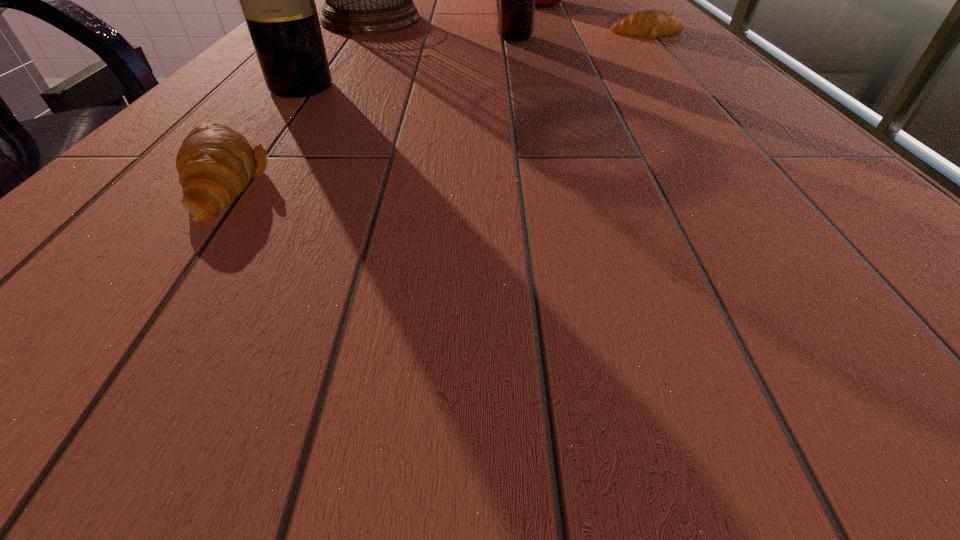
Find the location of `the left crescent roll`. the left crescent roll is located at coordinates (215, 163).

At what (x,y) coordinates should I click in order to perform the action: click on the nearest object. Please return your answer as a coordinate pair (x, y). The width and height of the screenshot is (960, 540). Looking at the image, I should click on (215, 163).

Where is `the rightmost object`? Image resolution: width=960 pixels, height=540 pixels. the rightmost object is located at coordinates (650, 23).

Locate an element on the screen. The image size is (960, 540). the right crescent roll is located at coordinates (650, 23).

Find the location of a particular element. birdcage is located at coordinates (358, 0).

What are the coordinates of `liquor` in the screenshot? It's located at (278, 0).

Find the location of a particular element. The height and width of the screenshot is (540, 960). beer bottle is located at coordinates (516, 10).

The width and height of the screenshot is (960, 540). I want to click on free region located on the right of the nearer crescent roll, so click(474, 181).

Locate an element on the screen. This screenshot has height=540, width=960. vacant space situated on the front of the right crescent roll is located at coordinates (676, 64).

Identify the location of free region located on the front-facing side of the birdcage. (583, 20).